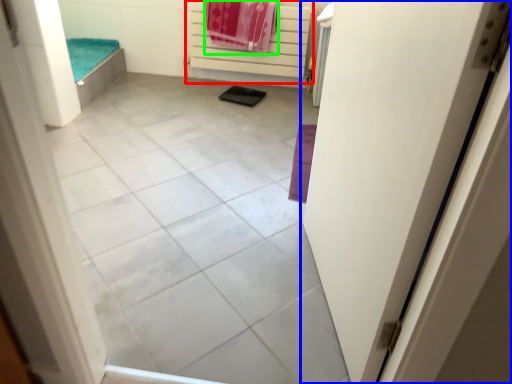
Question: Considering the real-world distances, which object is farthest from balustrade (highlighted by a red box)? door (highlighted by a blue box) or beach towel (highlighted by a green box)?

Choices:
 (A) door
 (B) beach towel

Answer: (A)